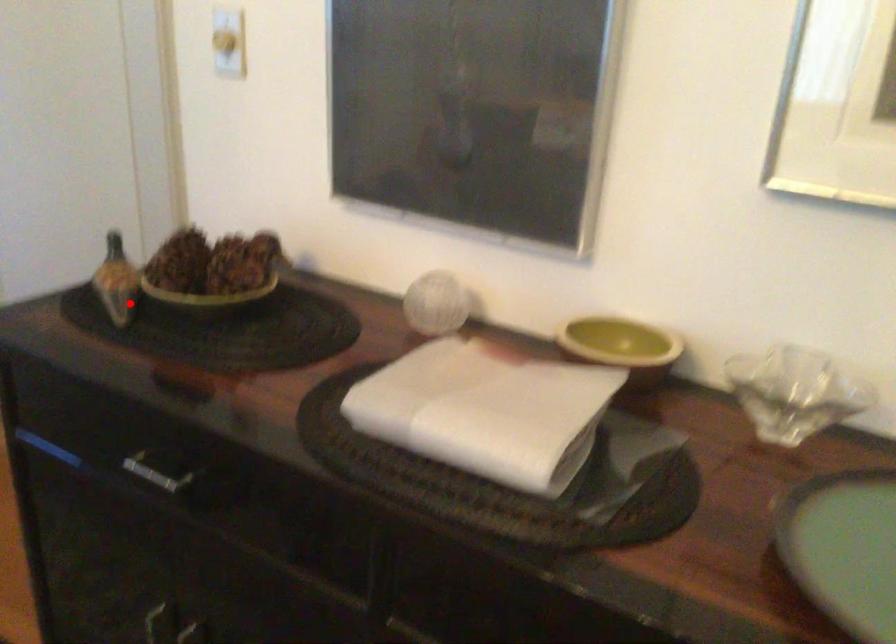
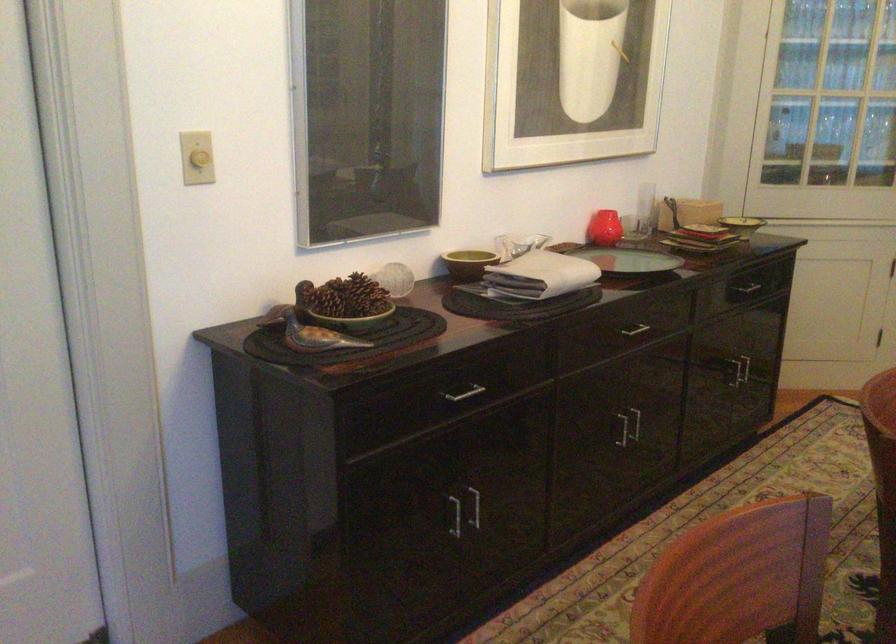
In the second image, find the point that corresponds to the highlighted location in the first image.

(312, 333)